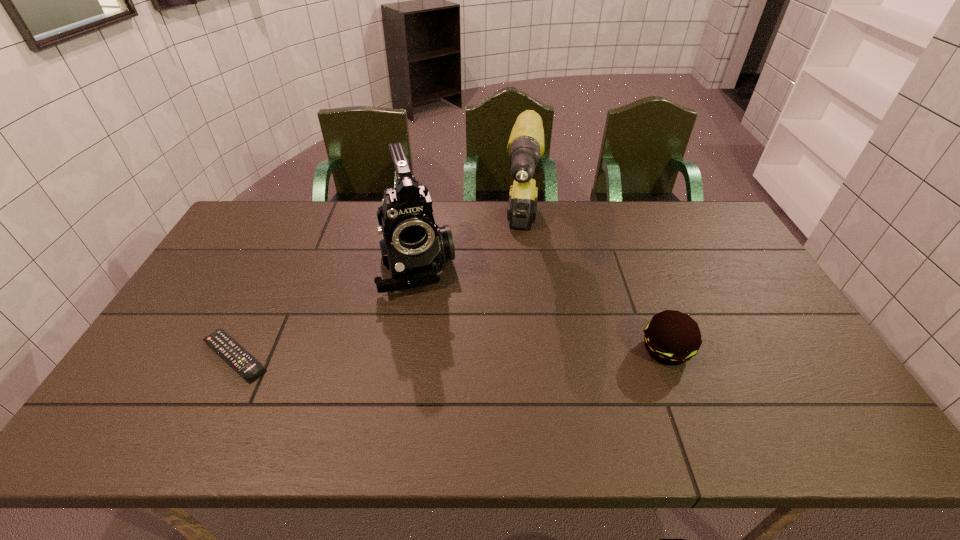
You are a GUI agent. You are given a task and a screenshot of the screen. Output one action in this format:
    pyautogui.click(x=<x>, y=<y>)
    Task: Click on the shortest object
    
    Given the screenshot: What is the action you would take?
    pyautogui.click(x=225, y=346)

Where is `remote control`? remote control is located at coordinates (225, 346).

At what (x,y) coordinates should I click in order to perform the action: click on patty. Please return your answer as a coordinate pair (x, y). This screenshot has height=540, width=960. Looking at the image, I should click on (671, 337).

Identify the location of the third tallest object. This screenshot has width=960, height=540. coord(671,337).

You are a GUI agent. You are given a task and a screenshot of the screen. Output one action in this format:
    pyautogui.click(x=<x>, y=<y>)
    Task: Click on the second object from left to right
    
    Given the screenshot: What is the action you would take?
    pyautogui.click(x=414, y=248)

At what (x,y) coordinates should I click in order to perform the action: click on the third object from left to right. Please return your answer as a coordinate pair (x, y). The height and width of the screenshot is (540, 960). Looking at the image, I should click on (526, 143).

The image size is (960, 540). Find the location of `free space located 0.170m on the right of the shortest object`. free space located 0.170m on the right of the shortest object is located at coordinates (338, 356).

Identify the location of free spot located 0.060m on the front of the third tallest object. (683, 393).

Locate an element on the screen. The height and width of the screenshot is (540, 960). vacant space positioned 0.350m on the lens mount of the third object from right to left is located at coordinates (452, 401).

Identify the location of free spot located on the lens mount of the third object from right to left. Image resolution: width=960 pixels, height=540 pixels. (436, 343).